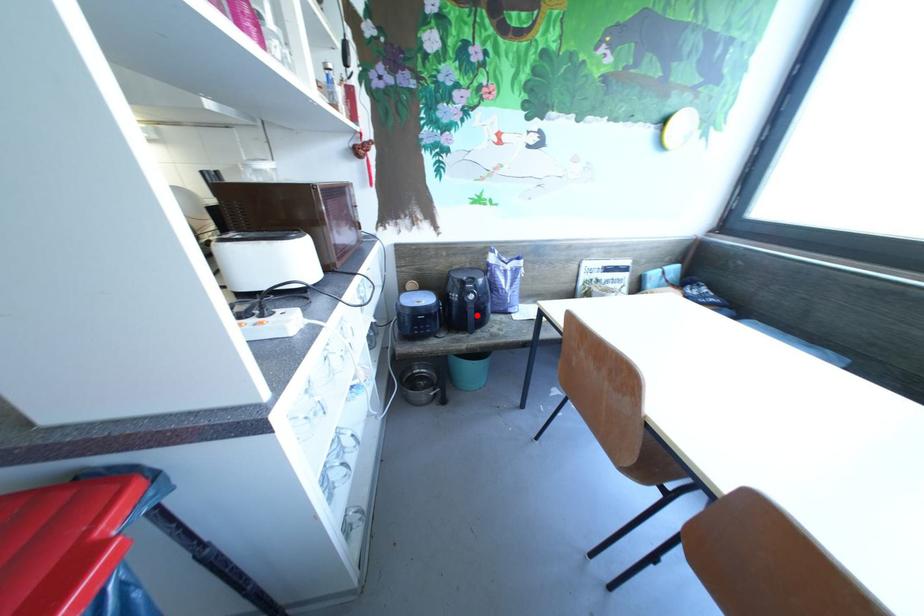
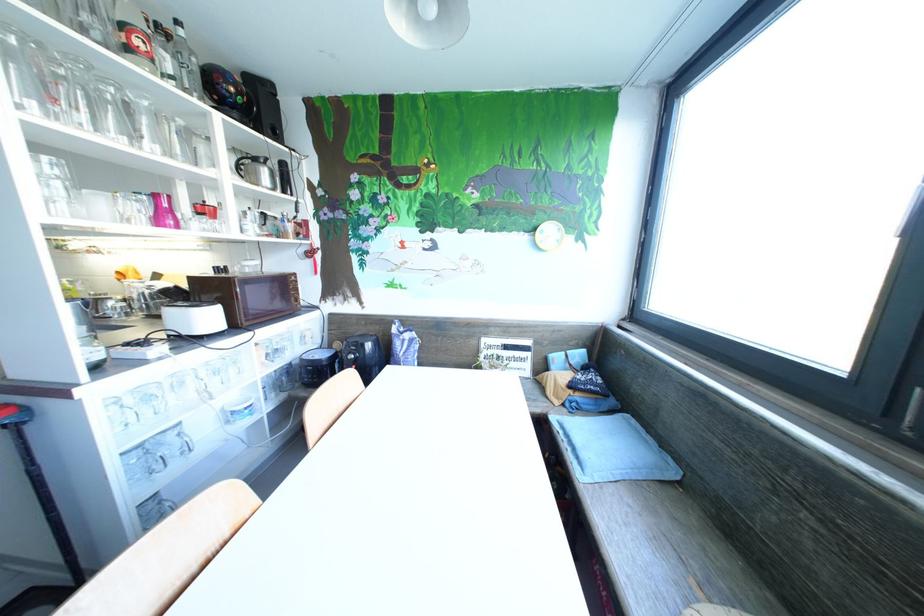
Question: I am providing you with two images of the same scene from different viewpoints. A red point is marked on the first image. At the location where the point appears in image 1, is it still visible in image 2?

Choices:
 (A) Yes
 (B) No

Answer: (B)